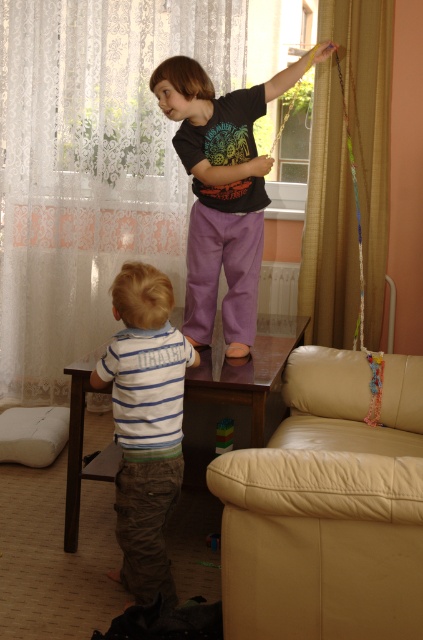
You are a parent trying to place a small toy between the white foam cushion at lower left and the wooden toy at lower center. What is the minimum distance you need to maintain between the cushion and the wooden toy to ensure the small toy fits?

The white foam cushion at lower left is 1.26 meters from the wooden toy at lower center, so the minimum distance needed is 1.26 meters to ensure the small toy can fit between them.

You are a parent trying to decide whether to place a new decorative item on the gold textured curtain at upper right or the multicolored plastic blocks at lower center. Which surface has a greater width to accommodate the item?

The gold textured curtain at upper right has a greater width than the multicolored plastic blocks at lower center, so it can accommodate larger decorative items.